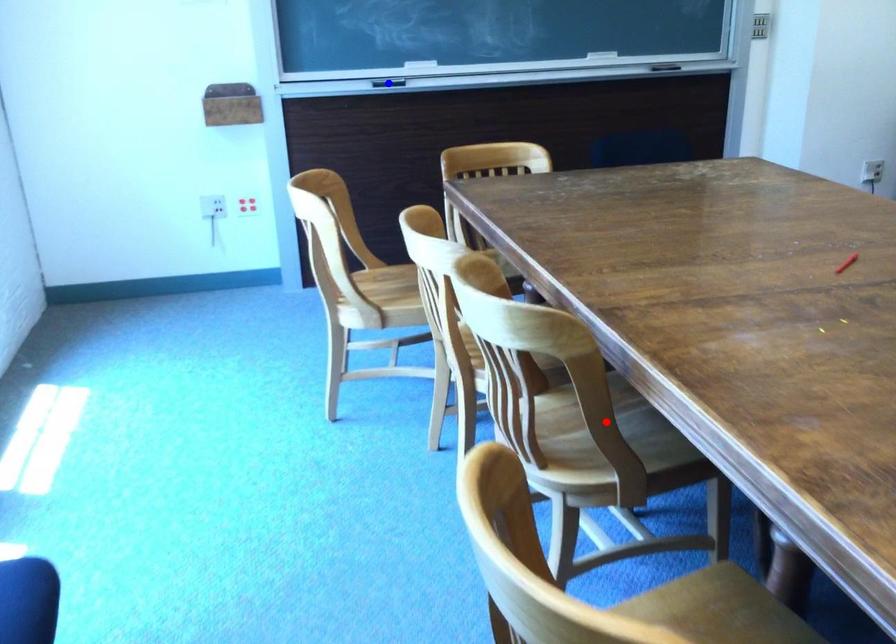
Question: In the image, two points are highlighted. Which point is nearer to the camera? Reply with the corresponding letter.

Choices:
 (A) blue point
 (B) red point

Answer: (B)